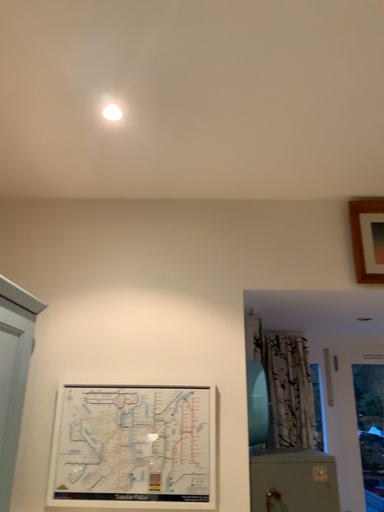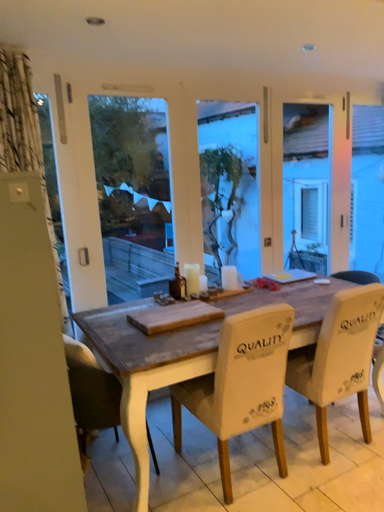
Question: How did the camera likely rotate when shooting the video?

Choices:
 (A) rotated upward
 (B) rotated downward

Answer: (B)